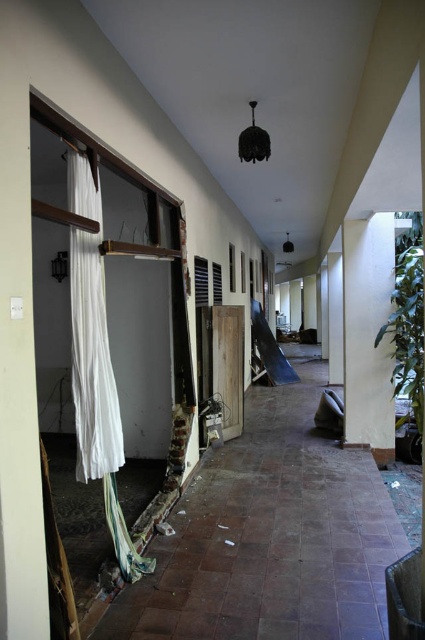
Question: Which object appears closest to the camera in this image?

Choices:
 (A) white fabric curtain at left
 (B) green textured pillar at right

Answer: (A)

Question: Which of the following is the closest to the observer?

Choices:
 (A) white fabric curtain at left
 (B) green textured pillar at right

Answer: (A)

Question: Does white fabric curtain at left appear over green textured pillar at right?

Choices:
 (A) yes
 (B) no

Answer: (B)

Question: Is white fabric curtain at left above green textured pillar at right?

Choices:
 (A) yes
 (B) no

Answer: (B)

Question: Is white fabric curtain at left to the right of green textured pillar at right from the viewer's perspective?

Choices:
 (A) yes
 (B) no

Answer: (B)